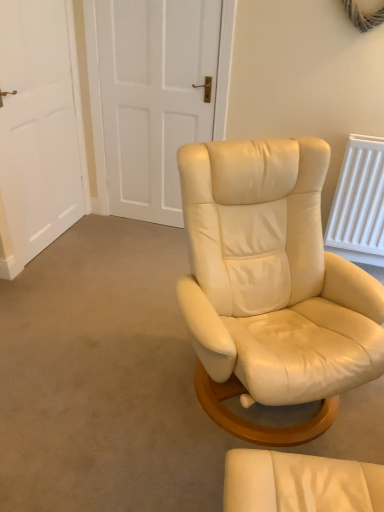
This screenshot has width=384, height=512. I want to click on vacant space to the right of white matte door at upper left, which is counted as the 1th door, starting from the left, so click(107, 241).